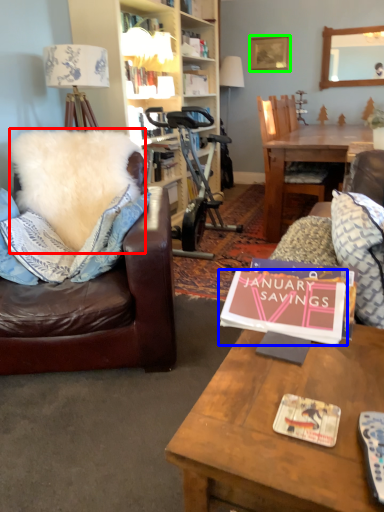
Question: Which object is positioned closest to pillow (highlighted by a red box)? Select from book (highlighted by a blue box) and picture frame (highlighted by a green box).

Choices:
 (A) book
 (B) picture frame

Answer: (A)